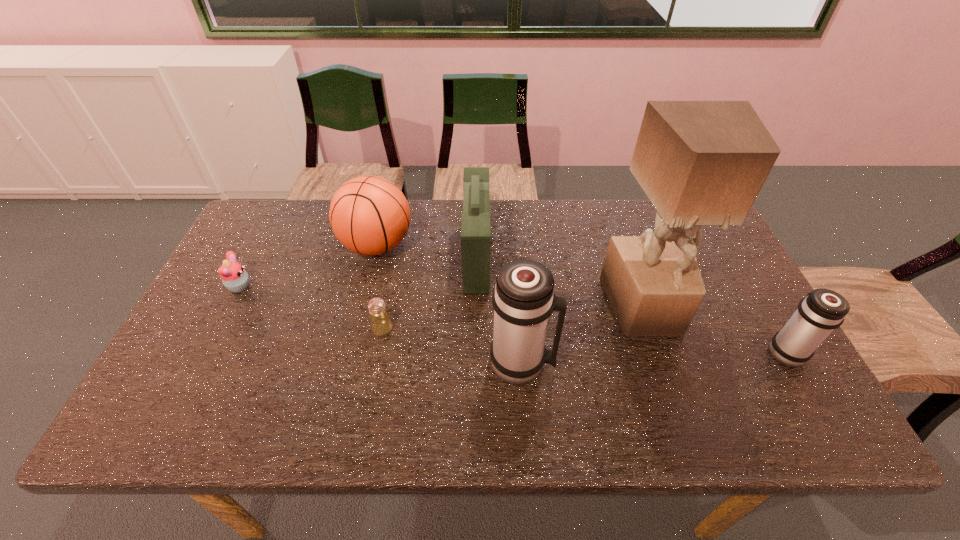
Where is `free space located 0.220m on the side with the handle of the taller thermos bottle`? free space located 0.220m on the side with the handle of the taller thermos bottle is located at coordinates (645, 363).

Find the location of `free region located 0.080m on the side with the handle of the rightmost object`. free region located 0.080m on the side with the handle of the rightmost object is located at coordinates (761, 309).

Image resolution: width=960 pixels, height=540 pixels. I want to click on vacant region located 0.140m on the side with the handle of the rightmost object, so click(x=752, y=293).

What are the coordinates of `vacant point located on the side with the handle of the rightmost object` in the screenshot? It's located at (749, 287).

Where is `vacant region located on the right of the basketball`? vacant region located on the right of the basketball is located at coordinates [x=529, y=246].

At what (x,y) coordinates should I click in order to perform the action: click on vacant space located on the face of the cupcake. Please return your answer as a coordinate pair (x, y). Image resolution: width=960 pixels, height=540 pixels. Looking at the image, I should click on (384, 287).

Locate an element on the screen. This screenshot has width=960, height=540. vacant area located on the front-facing side of the first-aid kit is located at coordinates (506, 256).

I want to click on free location located 0.130m on the front-facing side of the second object from right to left, so click(671, 386).

The width and height of the screenshot is (960, 540). What are the coordinates of `vacant space situated 0.120m on the left of the saltshaker` in the screenshot? It's located at (325, 329).

Locate an element on the screen. basketball located in the far edge section of the desktop is located at coordinates (369, 215).